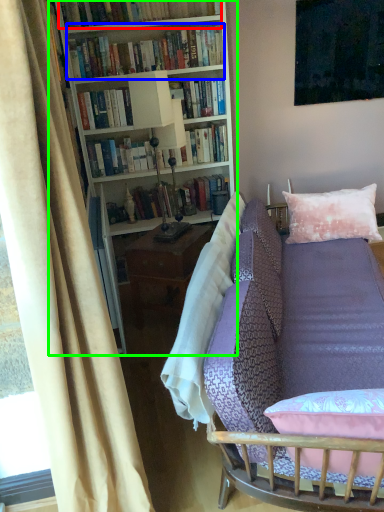
Question: Which object is the closest to the book (highlighted by a red box)? Choose among these: book (highlighted by a blue box) or bookcase (highlighted by a green box).

Choices:
 (A) book
 (B) bookcase

Answer: (A)